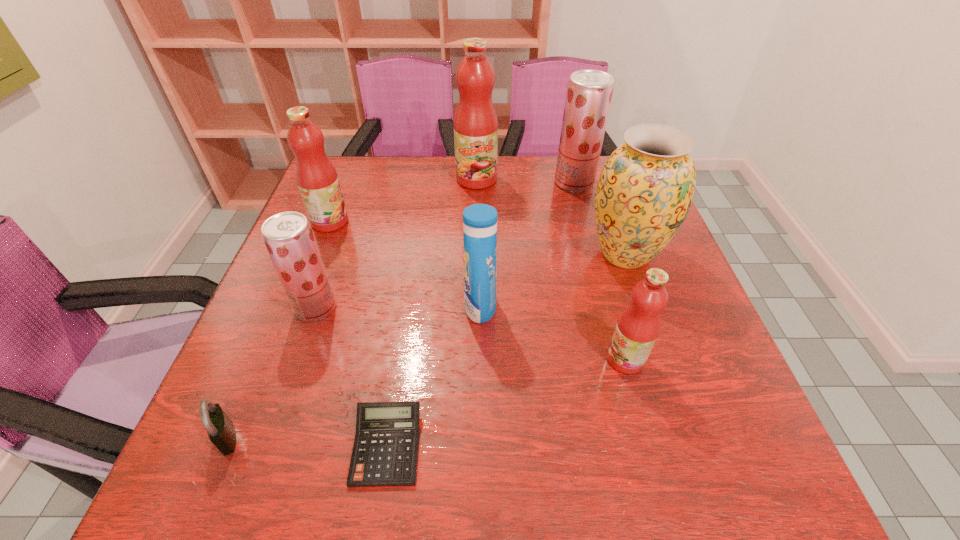
This screenshot has width=960, height=540. Identify the location of free space between the fourth farthest fruit juice and the bigger strawberry fruit juice. (445, 245).

Identify the location of free space between the second biggest pink fruit juice and the calculator. (358, 334).

Locate an element on the screen. Image resolution: width=960 pixels, height=540 pixels. free spot between the smallest pink fruit juice and the yellow vase is located at coordinates (625, 307).

This screenshot has width=960, height=540. In order to click on free space between the detergent and the third farthest fruit juice in this screenshot , I will do `click(405, 264)`.

I want to click on free space between the vase and the tallest object, so click(551, 217).

The image size is (960, 540). What are the coordinates of `vacant region between the nearer strawberry fruit juice and the padlock` in the screenshot? It's located at (272, 373).

This screenshot has width=960, height=540. Find the location of `free point between the yellow vase and the detergent`. free point between the yellow vase and the detergent is located at coordinates (553, 280).

Locate an element on the screen. vacant area between the nearest fruit juice and the farther strawberry fruit juice is located at coordinates (600, 271).

What are the coordinates of `free space between the left strawberry fruit juice and the tallest fruit juice` in the screenshot? It's located at (396, 244).

At what (x,y) coordinates should I click in order to perform the action: click on object that ranks as the third closest to the yellow vase. Please return your answer as a coordinate pair (x, y). Looking at the image, I should click on (479, 220).